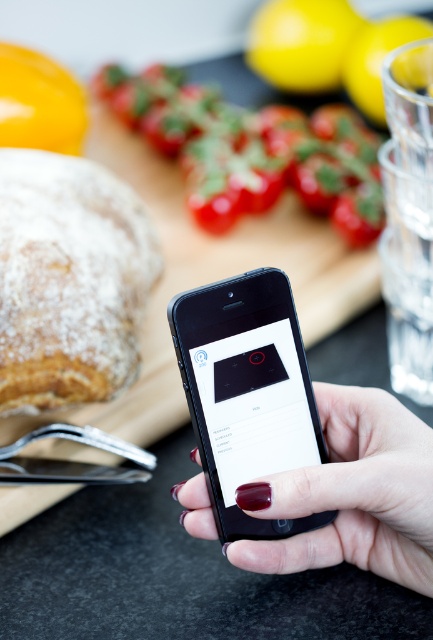
Question: Which object is positioned farthest from the yellow matte lemon at upper right?

Choices:
 (A) black matte phone at center
 (B) yellow matte lemon at upper center
 (C) shiny red tomatoes at center
 (D) powdery golden bread at left

Answer: (A)

Question: Is nail polish at center behind yellow matte lemon at upper right?

Choices:
 (A) yes
 (B) no

Answer: (B)

Question: Can you confirm if shiny red tomatoes at center is bigger than yellow matte lemon at upper center?

Choices:
 (A) no
 (B) yes

Answer: (B)

Question: Which object appears farthest from the camera in this image?

Choices:
 (A) smooth yellow pepper at upper left
 (B) black matte phone at center
 (C) yellow matte lemon at upper right
 (D) yellow matte lemon at upper center

Answer: (D)

Question: Can you confirm if black matte phone at center is positioned to the right of yellow matte lemon at upper right?

Choices:
 (A) no
 (B) yes

Answer: (A)

Question: Based on their relative distances, which object is farther from the black matte phone at center?

Choices:
 (A) powdery golden bread at left
 (B) shiny red tomatoes at center

Answer: (B)